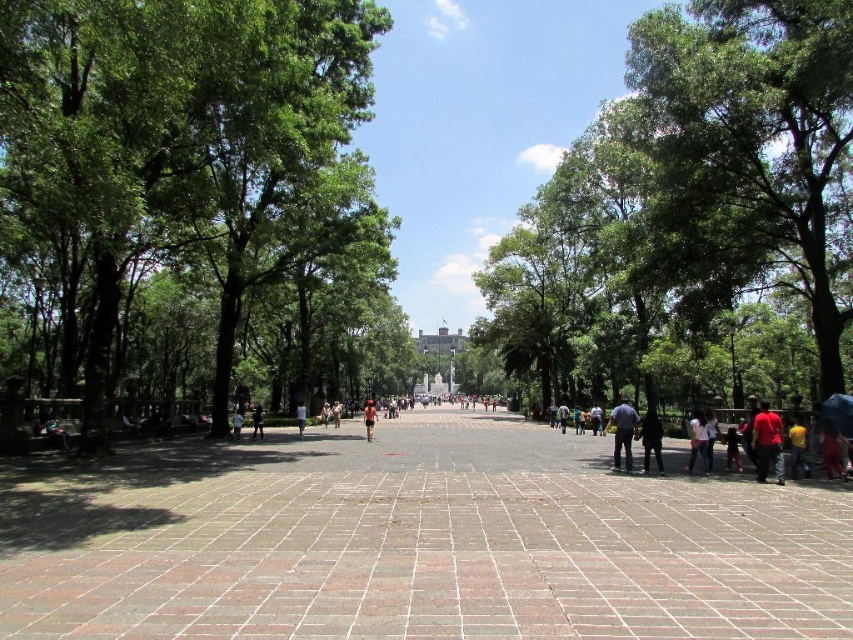
Does dark blue jeans at center have a smaller size compared to tan leather sandals at center?

Actually, dark blue jeans at center might be larger than tan leather sandals at center.

Can you confirm if dark blue jeans at center is thinner than tan leather sandals at center?

No.

Does point (259, 404) come behind point (339, 420)?

That is True.

The image size is (853, 640). I want to click on dark blue jeans at center, so [x=257, y=420].

Consider the image. Which of these two, red shirt at center or light brown fabric shirt at center, stands taller?

→ red shirt at center

Does red shirt at center have a lesser height compared to light brown fabric shirt at center?

In fact, red shirt at center may be taller than light brown fabric shirt at center.

Identify the location of red shirt at center. Image resolution: width=853 pixels, height=640 pixels. (369, 419).

Where is `red shirt at center`? red shirt at center is located at coordinates (369, 419).

Which is more to the left, dark blue shirt at center-right or light pink fabric dress at lower right?

From the viewer's perspective, light pink fabric dress at lower right appears more on the left side.

Which is above, dark blue shirt at center-right or light pink fabric dress at lower right?

light pink fabric dress at lower right

Is point (630, 444) positioned before point (704, 449)?

No, (630, 444) is behind (704, 449).

Image resolution: width=853 pixels, height=640 pixels. I want to click on dark blue shirt at center-right, so click(x=622, y=432).